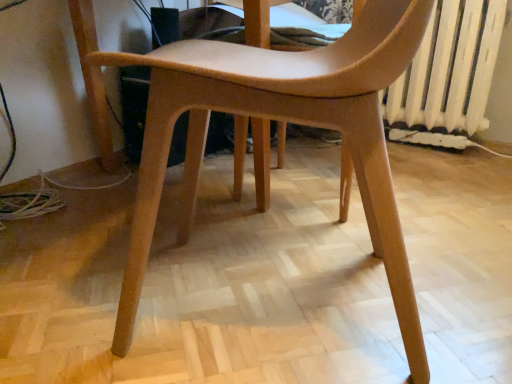
Question: Does matte wood chair at center have a smaller size compared to white painted metal radiator at right?

Choices:
 (A) no
 (B) yes

Answer: (A)

Question: Does matte wood chair at center have a lesser width compared to white painted metal radiator at right?

Choices:
 (A) no
 (B) yes

Answer: (A)

Question: Can you confirm if matte wood chair at center is positioned to the right of white painted metal radiator at right?

Choices:
 (A) yes
 (B) no

Answer: (B)

Question: Considering the relative sizes of matte wood chair at center and white painted metal radiator at right in the image provided, is matte wood chair at center wider than white painted metal radiator at right?

Choices:
 (A) no
 (B) yes

Answer: (B)

Question: Is matte wood chair at center turned away from white painted metal radiator at right?

Choices:
 (A) no
 (B) yes

Answer: (A)

Question: Considering the relative positions of matte wood chair at center and white painted metal radiator at right in the image provided, is matte wood chair at center behind white painted metal radiator at right?

Choices:
 (A) no
 (B) yes

Answer: (A)

Question: Is white painted metal radiator at right located outside matte wood chair at center?

Choices:
 (A) yes
 (B) no

Answer: (A)

Question: Is white painted metal radiator at right with matte wood chair at center?

Choices:
 (A) yes
 (B) no

Answer: (B)

Question: Does white painted metal radiator at right have a greater height compared to matte wood chair at center?

Choices:
 (A) no
 (B) yes

Answer: (A)

Question: From a real-world perspective, is white painted metal radiator at right over matte wood chair at center?

Choices:
 (A) yes
 (B) no

Answer: (A)

Question: Does white painted metal radiator at right have a larger size compared to matte wood chair at center?

Choices:
 (A) no
 (B) yes

Answer: (A)

Question: Considering the relative sizes of white painted metal radiator at right and matte wood chair at center in the image provided, is white painted metal radiator at right thinner than matte wood chair at center?

Choices:
 (A) yes
 (B) no

Answer: (A)

Question: From their relative heights in the image, would you say white painted metal radiator at right is taller or shorter than matte wood chair at center?

Choices:
 (A) short
 (B) tall

Answer: (A)